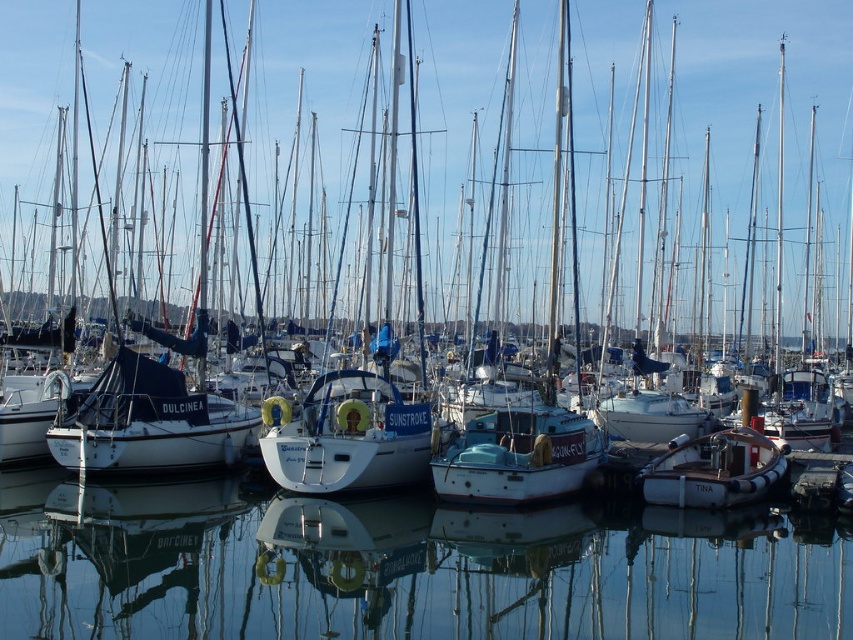
You are a photographer planning to capture a wide shot of the marina. You notice two sailboats in the center of the image, a white matte sailboat at center and a white glossy sailboat at center. Which of these two boats is wider?

The white matte sailboat at center is wider than the white glossy sailboat at center according to the description.

You are standing at the edge of the marina and want to take a photo of both the transparent glass water at center and the white matte sailboat at center. Which object will appear shorter in the photo?

The transparent glass water at center will appear shorter in the photo because it has a lesser height compared to the white matte sailboat at center.

You are standing at the edge of the marina and want to take a photo of two points in the scene. The first point is labeled as point (x=218, y=500) and the second is point (x=310, y=472). Since you want to focus on the closer point to you, which point should you adjust your camera to focus on?

Point (x=218, y=500) is further to the camera than point (x=310, y=472), so you should focus on point (x=218, y=500) because it is closer to you.